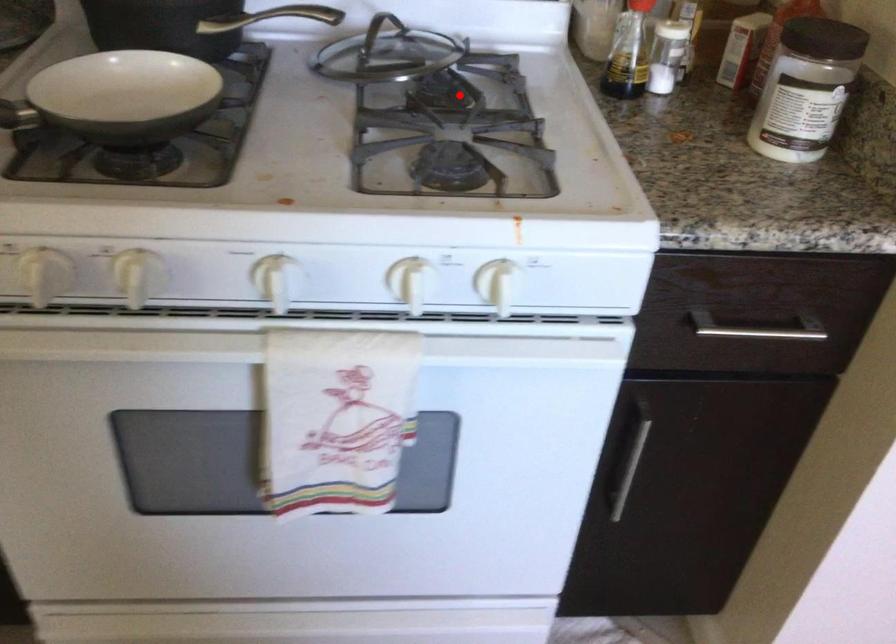
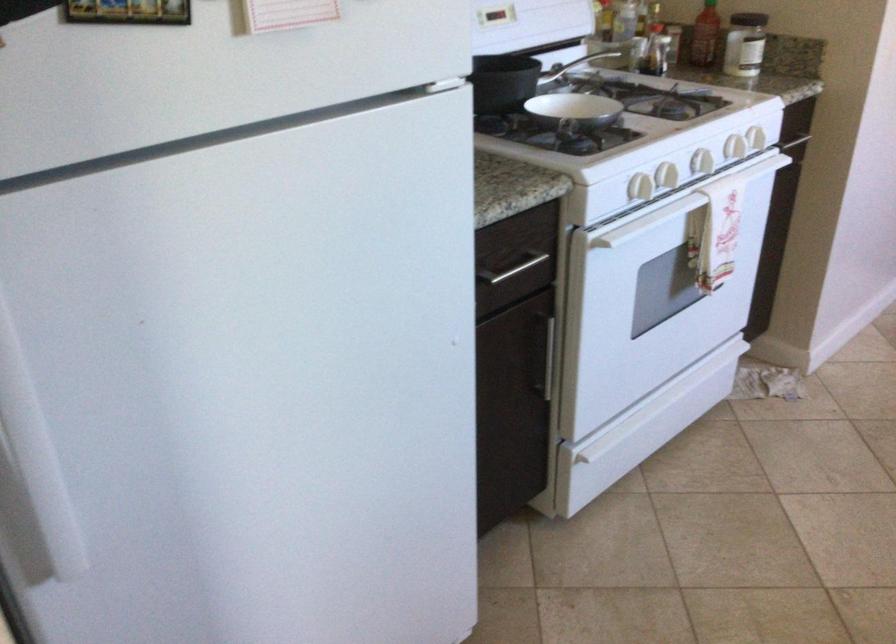
Question: I am providing you with two images of the same scene from different viewpoints. A red point is shown in image1. For the corresponding object point in image2, is it positioned nearer or farther from the camera?

Choices:
 (A) Nearer
 (B) Farther

Answer: (B)